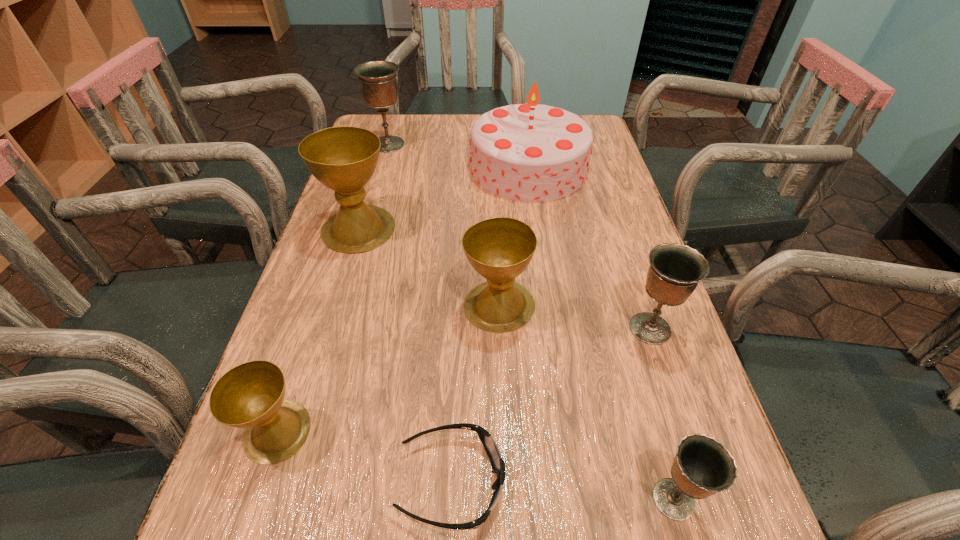
At what (x,y) coordinates should I click in order to perform the action: click on birthday cake. Please return your answer as a coordinate pair (x, y). This screenshot has width=960, height=540. Looking at the image, I should click on (531, 152).

Where is `the biggest brown chalice`? The image size is (960, 540). the biggest brown chalice is located at coordinates (344, 159).

Locate an element on the screen. This screenshot has height=540, width=960. the fifth nearest chalice is located at coordinates (x=344, y=159).

At what (x,y) coordinates should I click in order to perform the action: click on the farthest bronze chalice. Please return your answer as a coordinate pair (x, y). This screenshot has height=540, width=960. Looking at the image, I should click on (378, 82).

Locate an element on the screen. The image size is (960, 540). the leftmost bronze chalice is located at coordinates (378, 82).

Image resolution: width=960 pixels, height=540 pixels. I want to click on the rightmost brown chalice, so click(x=499, y=249).

Where is `the second biggest brown chalice`? the second biggest brown chalice is located at coordinates (499, 249).

In order to click on the second biggest bronze chalice in this screenshot , I will do `click(675, 270)`.

At what (x,y) coordinates should I click in order to perform the action: click on the smallest brown chalice. Please return your answer as a coordinate pair (x, y). This screenshot has width=960, height=540. Looking at the image, I should click on (251, 395).

At what (x,y) coordinates should I click in order to perform the action: click on the second nearest chalice. Please return your answer as a coordinate pair (x, y). The width and height of the screenshot is (960, 540). Looking at the image, I should click on (251, 395).